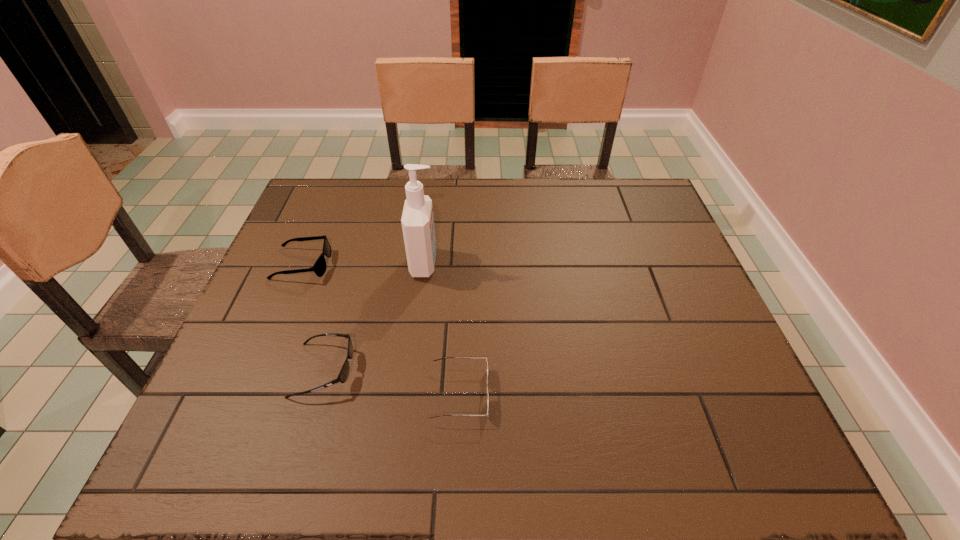
Where is `the third object from left to right`? This screenshot has width=960, height=540. the third object from left to right is located at coordinates (417, 220).

At what (x,y) coordinates should I click in order to perform the action: click on cleansing agent. Please return your answer as a coordinate pair (x, y). This screenshot has height=540, width=960. Looking at the image, I should click on (417, 220).

Locate an element on the screen. Image resolution: width=960 pixels, height=540 pixels. the second sunglasses from left to right is located at coordinates (343, 375).

Identify the location of the farthest sunglasses. Image resolution: width=960 pixels, height=540 pixels. (319, 268).

The height and width of the screenshot is (540, 960). Find the location of `the leftmost object`. the leftmost object is located at coordinates (319, 268).

I want to click on the shortest sunglasses, so click(443, 358).

The image size is (960, 540). What are the coordinates of `the rightmost object` in the screenshot? It's located at (443, 358).

The image size is (960, 540). Find the location of `blank area located 0.240m on the front label of the cleansing agent`. blank area located 0.240m on the front label of the cleansing agent is located at coordinates (527, 264).

In order to click on free space located 0.390m on the front-facing side of the third object from right to left in this screenshot , I will do `click(533, 370)`.

Identify the location of free spot located 0.350m on the front-facing side of the farthest sunglasses. (459, 265).